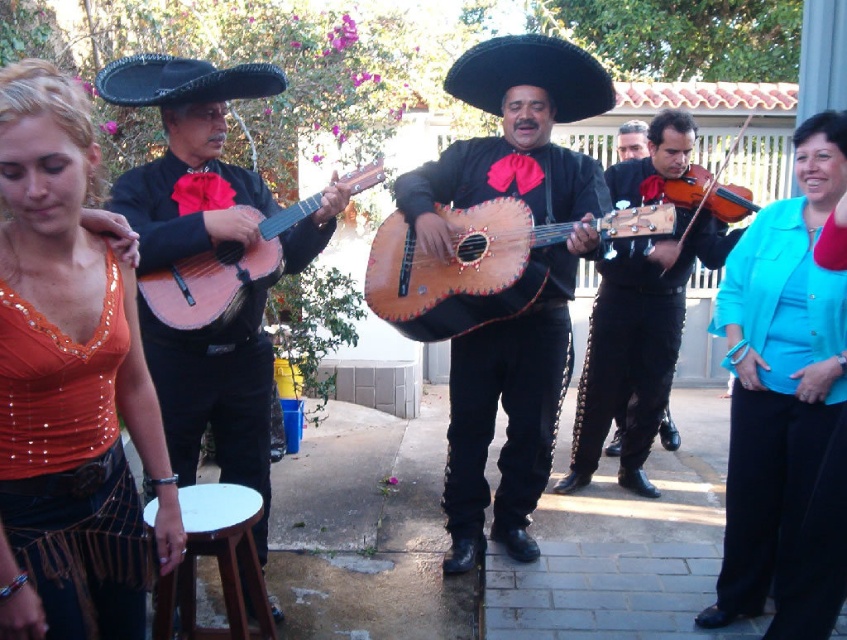
Question: Can you confirm if leather-like brown guitar at center is positioned below wooden acoustic guitar at center-left?

Choices:
 (A) yes
 (B) no

Answer: (B)

Question: Which point appears closest to the camera in this image?

Choices:
 (A) (137, 97)
 (B) (474, 508)
 (C) (710, 188)

Answer: (A)

Question: Which object is closer to the camera taking this photo?

Choices:
 (A) matte black violin at right
 (B) black felt sombrero at center
 (C) teal fabric jacket at right
 (D) black felt sombrero at upper left

Answer: (C)

Question: Does orange sequined blouse at left have a lesser width compared to matte black mariachi hat at upper left?

Choices:
 (A) yes
 (B) no

Answer: (A)

Question: Which of the following is the closest to the observer?

Choices:
 (A) black felt sombrero at center
 (B) shiny brown guitar at right

Answer: (A)

Question: Does matte black mariachi hat at upper left have a greater width compared to black felt sombrero at upper left?

Choices:
 (A) no
 (B) yes

Answer: (B)